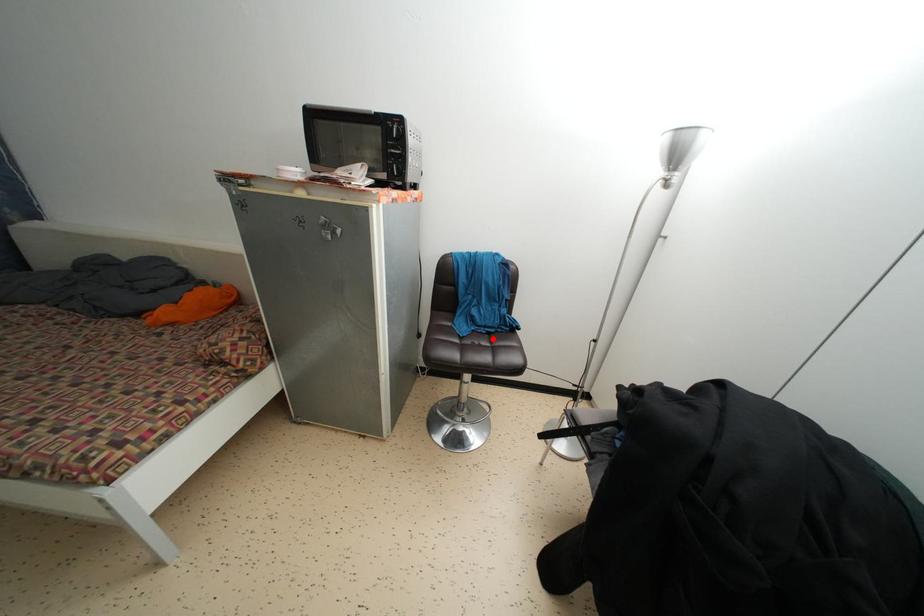
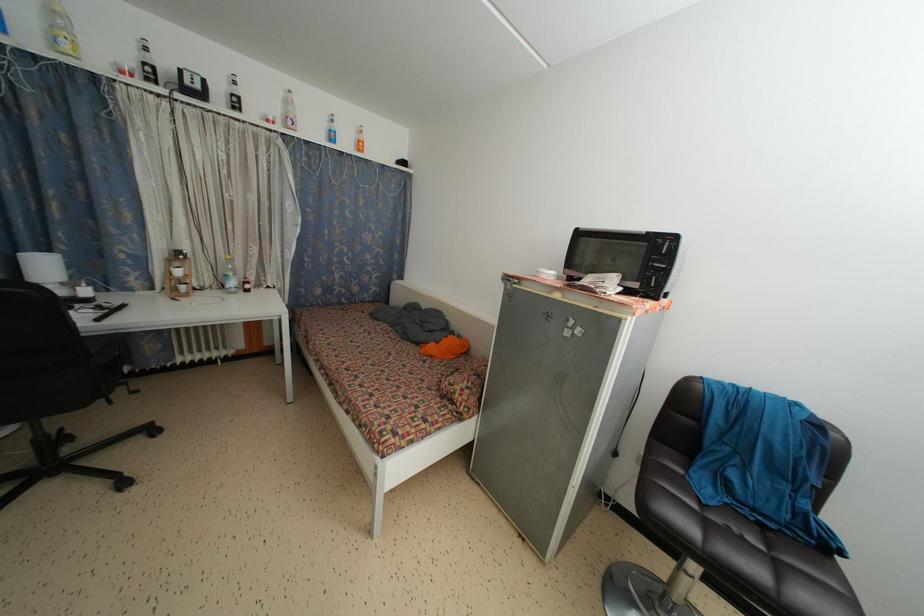
The point at the highlighted location is marked in the first image. Where is the corresponding point in the second image?

(767, 532)